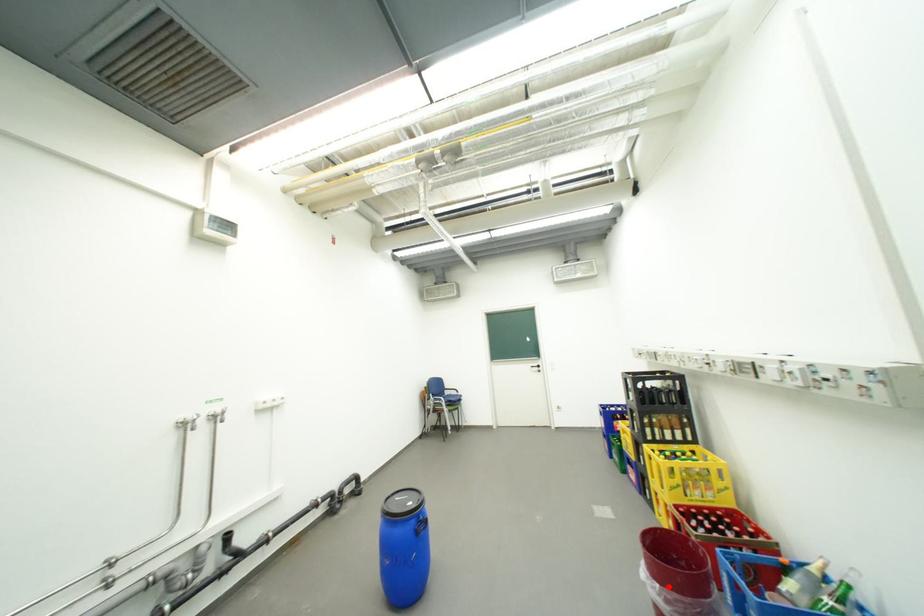
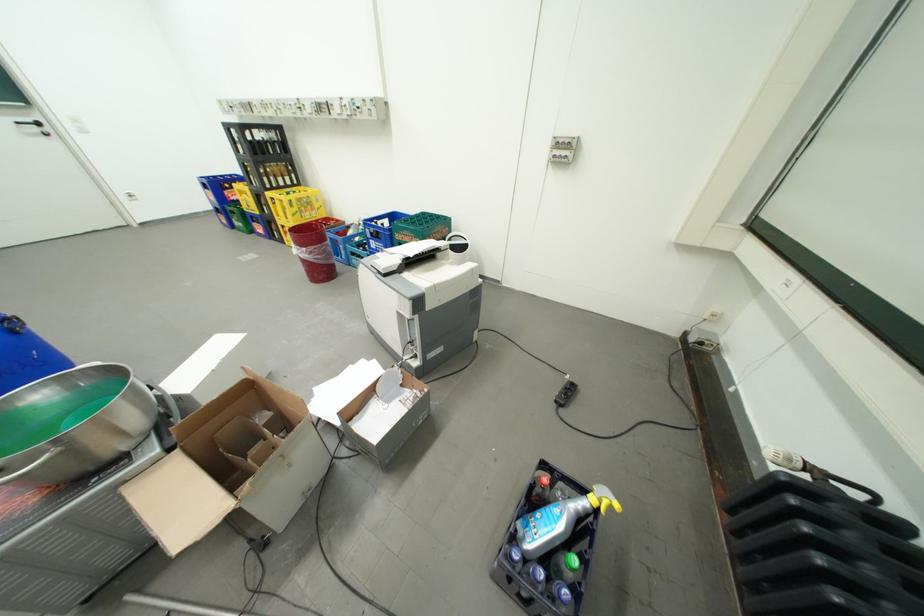
The point at the highlighted location is marked in the first image. Where is the corresponding point in the second image?

(314, 249)